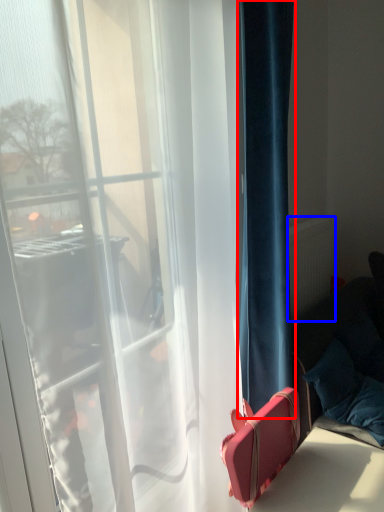
Question: Which object is further to the camera taking this photo, curtain (highlighted by a red box) or radiator (highlighted by a blue box)?

Choices:
 (A) curtain
 (B) radiator

Answer: (B)